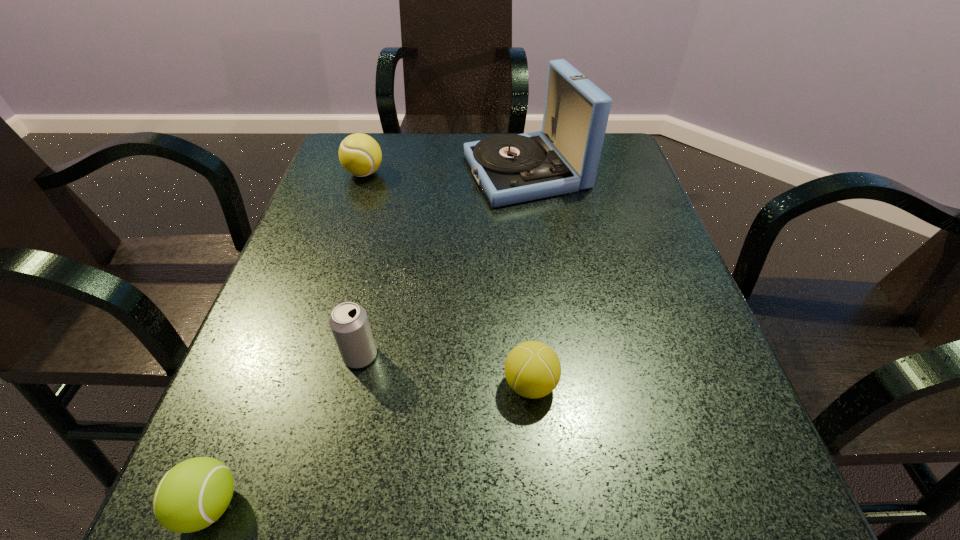
You are a GUI agent. You are given a task and a screenshot of the screen. Output one action in this format:
    pyautogui.click(x=<x>, y=<y>)
    Task: Click on the vacant space that's between the tallest object and the farthest tennis ball
    
    Given the screenshot: What is the action you would take?
    pyautogui.click(x=445, y=173)

Where is `unoccupied position between the third object from right to left and the tallest object`? This screenshot has width=960, height=540. unoccupied position between the third object from right to left and the tallest object is located at coordinates (443, 264).

Where is `free spot between the tallest tennis ball and the second farthest tennis ball`? free spot between the tallest tennis ball and the second farthest tennis ball is located at coordinates (447, 279).

Locate an element on the screen. vacant space that's between the third object from left to right and the phonograph record is located at coordinates (443, 264).

Locate an element on the screen. empty space between the farthest tennis ball and the tallest object is located at coordinates (445, 173).

At what (x,y) coordinates should I click in order to perform the action: click on free spot between the tallest tennis ball and the third object from left to right. Please return your answer as a coordinate pair (x, y). The height and width of the screenshot is (540, 960). Looking at the image, I should click on (362, 265).

The width and height of the screenshot is (960, 540). In order to click on free spot between the third object from left to right and the rightmost tennis ball in this screenshot , I will do `click(445, 370)`.

The height and width of the screenshot is (540, 960). I want to click on the closest object to the phonograph record, so click(x=360, y=155).

Identify the location of the third closest object to the phonograph record. Image resolution: width=960 pixels, height=540 pixels. (532, 369).

The width and height of the screenshot is (960, 540). What are the coordinates of `tennis ball that stands as the closest to the farthest tennis ball` in the screenshot? It's located at (532, 369).